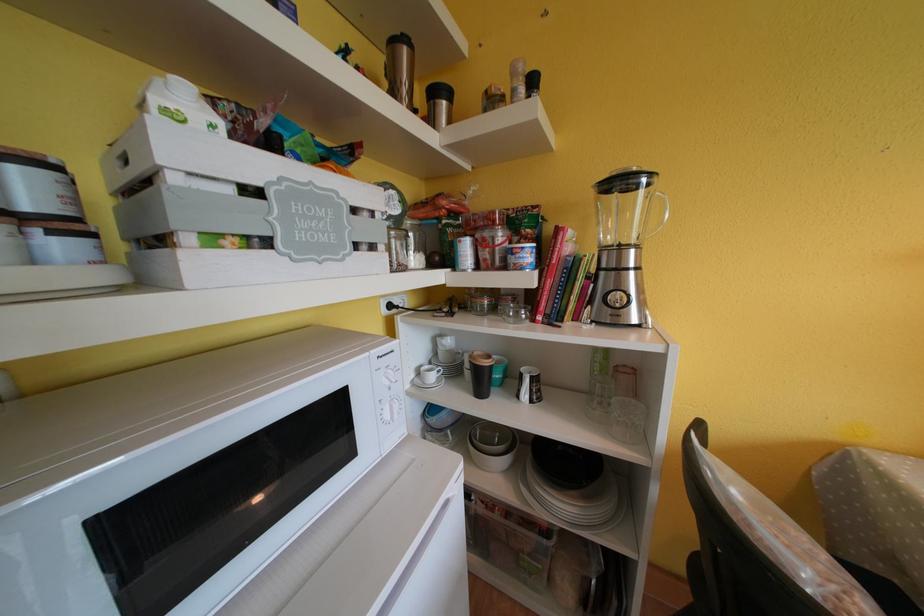
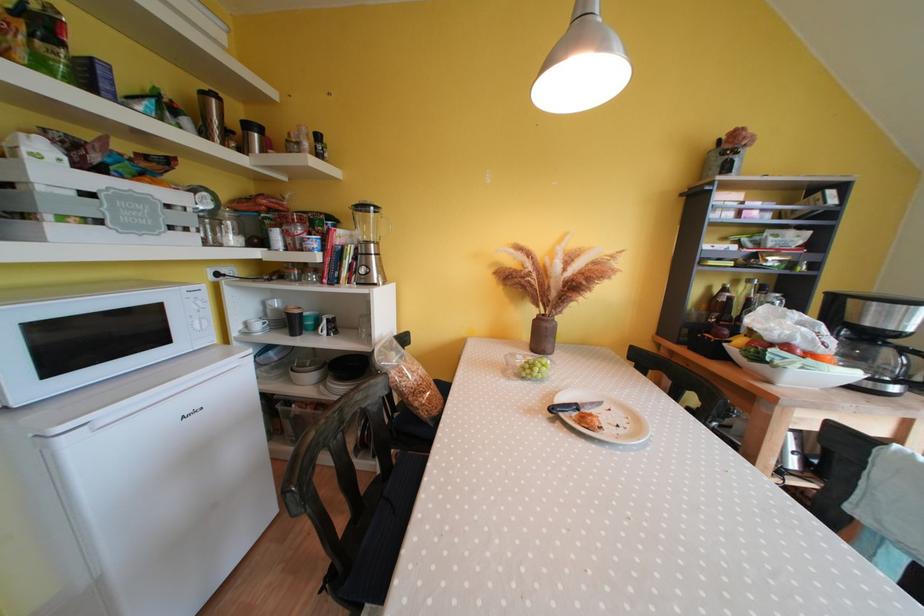
The point at (x=638, y=254) is marked in the first image. Where is the corresponding point in the second image?

(379, 249)